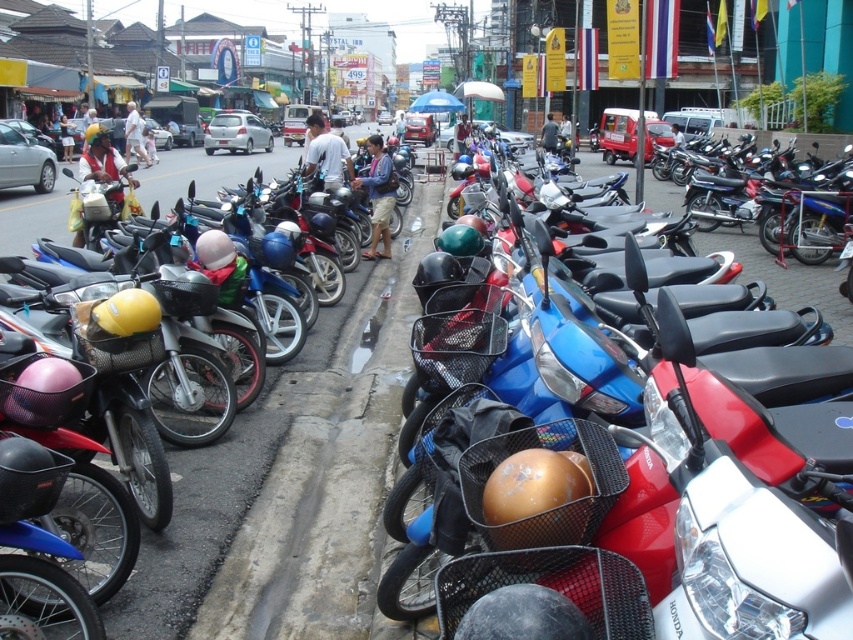
Does blue glossy motorcycle at center appear on the left side of matte blue helmet at center?

No, blue glossy motorcycle at center is not to the left of matte blue helmet at center.

Is blue glossy motorcycle at center above matte blue helmet at center?

Yes, blue glossy motorcycle at center is above matte blue helmet at center.

Is point (654, 189) farther from camera compared to point (366, 144)?

Yes, it is behind point (366, 144).

I want to click on blue glossy motorcycle at center, so click(786, 278).